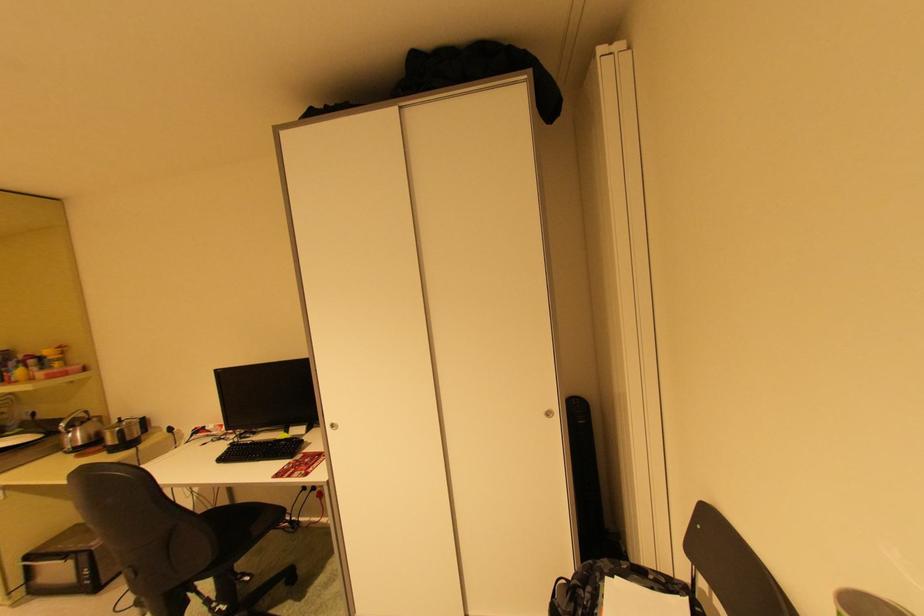
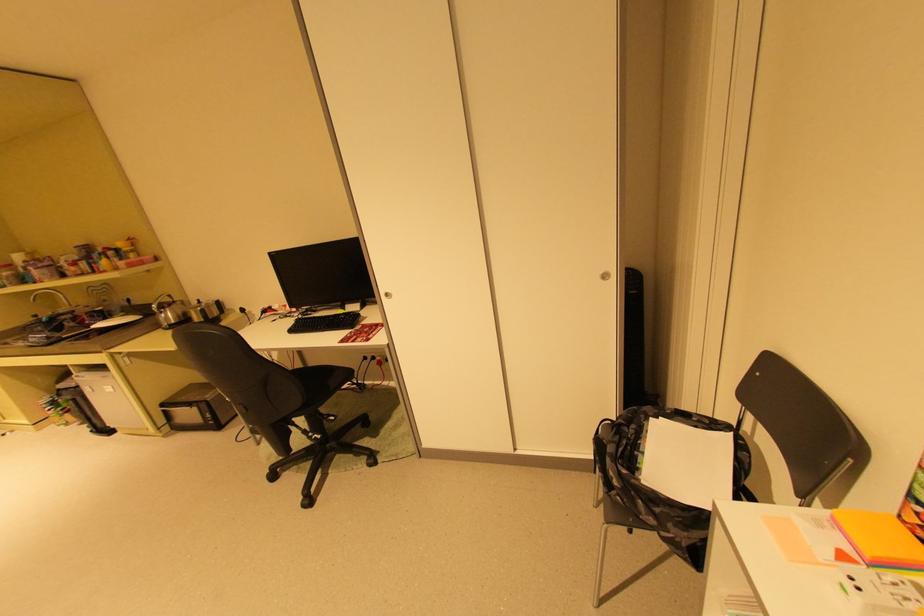
The point at [96,438] is marked in the first image. Where is the corresponding point in the second image?

(187, 317)